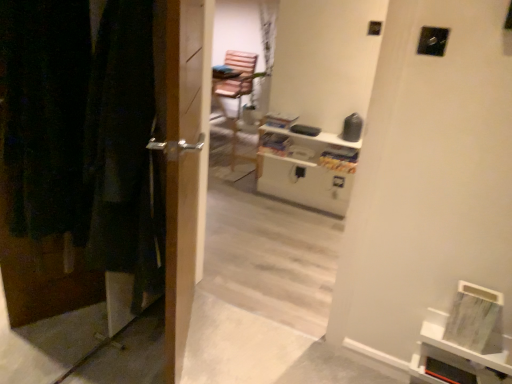
At what (x,y) coordinates should I click in order to perform the action: click on free spot above white matte bookshelf at lower right (from a real-world perspective). Please return your answer as a coordinate pair (x, y). Image resolution: width=512 pixels, height=384 pixels. Looking at the image, I should click on (472, 326).